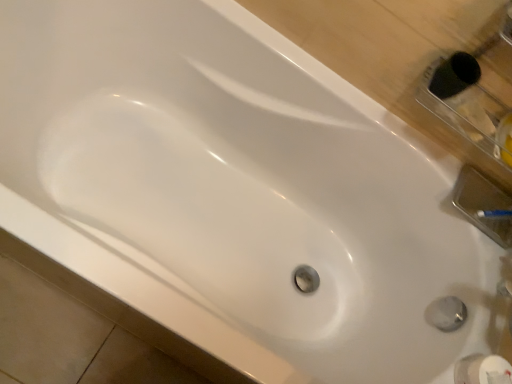
Where is `free space to the back side of white matte toilet paper at lower right`? The image size is (512, 384). free space to the back side of white matte toilet paper at lower right is located at coordinates (488, 313).